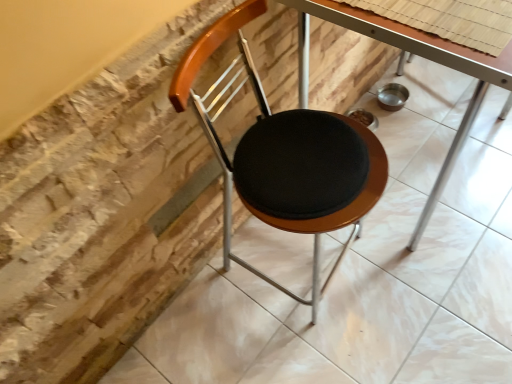
In order to face matte black seat at center, should I rotate leftwards or rightwards?

Rotate right and turn 6.713 degrees.

What do you see at coordinates (285, 156) in the screenshot? I see `matte black seat at center` at bounding box center [285, 156].

You are a GUI agent. You are given a task and a screenshot of the screen. Output one action in this format:
    pyautogui.click(x=<x>, y=<y>)
    Task: Click on the matte black seat at center
    Image resolution: width=512 pixels, height=384 pixels.
    Given the screenshot: What is the action you would take?
    pyautogui.click(x=285, y=156)

What is the approximate width of matte black seat at center?

matte black seat at center is 19.29 inches in width.

Where is `metallic silver table at center`? This screenshot has height=384, width=512. metallic silver table at center is located at coordinates (403, 70).

What do you see at coordinates (403, 70) in the screenshot?
I see `metallic silver table at center` at bounding box center [403, 70].

Image resolution: width=512 pixels, height=384 pixels. I want to click on matte black seat at center, so click(285, 156).

Considering the positions of objects metallic silver table at center and matte black seat at center in the image provided, who is more to the right, metallic silver table at center or matte black seat at center?

From the viewer's perspective, metallic silver table at center appears more on the right side.

In the scene shown: Is metallic silver table at center closer to the viewer compared to matte black seat at center?

No, the depth of metallic silver table at center is greater than that of matte black seat at center.

Is point (344, 9) closer to camera compared to point (330, 160)?

That is True.

Looking at this image, from the image's perspective, which is above, metallic silver table at center or matte black seat at center?

metallic silver table at center appears higher in the image.

From a real-world perspective, is metallic silver table at center positioned over matte black seat at center based on gravity?

Incorrect, from a real-world perspective, metallic silver table at center is lower than matte black seat at center.

Which of these two, metallic silver table at center or matte black seat at center, is wider?

With larger width is metallic silver table at center.

Is metallic silver table at center shorter than matte black seat at center?

Yes.

Can you confirm if metallic silver table at center is smaller than matte black seat at center?

Incorrect, metallic silver table at center is not smaller in size than matte black seat at center.

Can we say metallic silver table at center lies outside matte black seat at center?

Yes.

Is metallic silver table at center touching matte black seat at center?

No, metallic silver table at center is not touching matte black seat at center.

Is matte black seat at center at the back of metallic silver table at center?

No, matte black seat at center is not at the back of metallic silver table at center.

The image size is (512, 384). In order to click on chair above the metallic silver table at center (from a real-world perspective) in this screenshot , I will do `click(285, 156)`.

Considering the positions of objects matte black seat at center and metallic silver table at center in the image provided, who is more to the right, matte black seat at center or metallic silver table at center?

From the viewer's perspective, metallic silver table at center appears more on the right side.

Relative to metallic silver table at center, is matte black seat at center in front or behind?

matte black seat at center is positioned closer to the viewer than metallic silver table at center.

Does point (217, 145) appear closer or farther from the camera than point (307, 58)?

Clearly, point (217, 145) is closer to the camera than point (307, 58).

From the image's perspective, which is above, matte black seat at center or metallic silver table at center?

metallic silver table at center is shown above in the image.

From a real-world perspective, who is located higher, matte black seat at center or metallic silver table at center?

matte black seat at center, from a real-world perspective.

Between matte black seat at center and metallic silver table at center, which one has smaller width?

matte black seat at center is thinner.

Does matte black seat at center have a lesser height compared to metallic silver table at center?

No.

Considering the relative sizes of matte black seat at center and metallic silver table at center in the image provided, is matte black seat at center smaller than metallic silver table at center?

Yes, matte black seat at center is smaller than metallic silver table at center.

Is matte black seat at center outside of metallic silver table at center?

matte black seat at center is positioned outside metallic silver table at center.

Is there a large distance between matte black seat at center and metallic silver table at center?

No, matte black seat at center is not far away from metallic silver table at center.

Could you tell me if matte black seat at center is facing metallic silver table at center?

No, matte black seat at center does not turn towards metallic silver table at center.

Locate an element on the screen. chair above the metallic silver table at center (from a real-world perspective) is located at coordinates (285, 156).

Locate an element on the screen. The image size is (512, 384). table below the matte black seat at center (from a real-world perspective) is located at coordinates (403, 70).

Find the location of a particular element. table on the right of matte black seat at center is located at coordinates (403, 70).